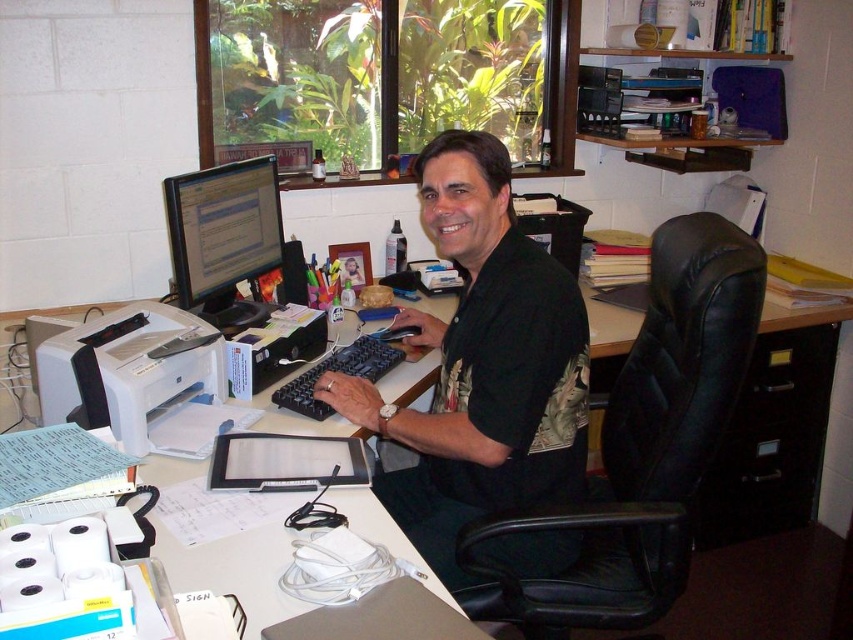
In the scene shown: How far apart are black matte shirt at center and matte black monitor at upper left?

22.72 inches

Can you confirm if black matte shirt at center is positioned below matte black monitor at upper left?

Correct, black matte shirt at center is located below matte black monitor at upper left.

This screenshot has width=853, height=640. In order to click on black matte shirt at center in this screenshot , I will do `click(480, 364)`.

Where is `black matte shirt at center`? This screenshot has height=640, width=853. black matte shirt at center is located at coordinates (480, 364).

Is white matte printer at left shorter than matte black monitor at upper left?

Correct, white matte printer at left is not as tall as matte black monitor at upper left.

Can you confirm if white matte printer at left is positioned to the left of matte black monitor at upper left?

Yes, white matte printer at left is to the left of matte black monitor at upper left.

Locate an element on the screen. white matte printer at left is located at coordinates (129, 368).

Can you confirm if black matte shirt at center is positioned below white matte printer at left?

No.

Does black matte shirt at center have a greater height compared to white matte printer at left?

Correct, black matte shirt at center is much taller as white matte printer at left.

At what (x,y) coordinates should I click in order to perform the action: click on black matte shirt at center. Please return your answer as a coordinate pair (x, y). This screenshot has width=853, height=640. Looking at the image, I should click on (480, 364).

Identify the location of black matte shirt at center. The image size is (853, 640). (480, 364).